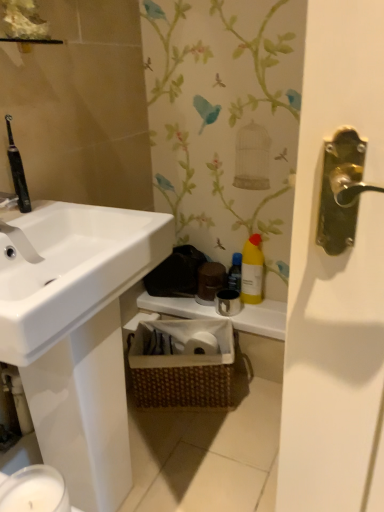
Question: From a real-world perspective, is yellow matte bottle at center above or below yellow plastic bottle at upper right?

Choices:
 (A) below
 (B) above

Answer: (A)

Question: Considering the positions of point (231, 280) and point (251, 258), is point (231, 280) closer or farther from the camera than point (251, 258)?

Choices:
 (A) farther
 (B) closer

Answer: (A)

Question: Which of these objects is positioned farthest from the white matte counter top at center?

Choices:
 (A) yellow plastic bottle at upper right
 (B) yellow matte bottle at center
 (C) woven brown basket at center

Answer: (B)

Question: Which object is the farthest from the white matte counter top at center?

Choices:
 (A) woven brown basket at center
 (B) yellow plastic bottle at upper right
 (C) yellow matte bottle at center

Answer: (C)